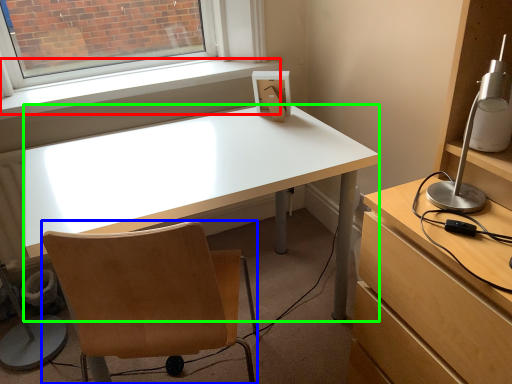
Question: Considering the real-world distances, which object is closest to window sill (highlighted by a red box)? chair (highlighted by a blue box) or desk (highlighted by a green box).

Choices:
 (A) chair
 (B) desk

Answer: (B)